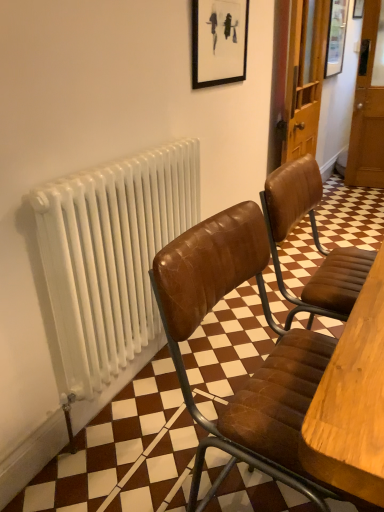
Question: From the image's perspective, is wooden picture frame at upper right located above white metallic radiator at left?

Choices:
 (A) no
 (B) yes

Answer: (B)

Question: From a real-world perspective, is wooden picture frame at upper right located beneath white metallic radiator at left?

Choices:
 (A) yes
 (B) no

Answer: (B)

Question: Considering the relative positions of wooden picture frame at upper right and white metallic radiator at left in the image provided, is wooden picture frame at upper right behind white metallic radiator at left?

Choices:
 (A) yes
 (B) no

Answer: (A)

Question: Considering the relative positions of wooden picture frame at upper right and white metallic radiator at left in the image provided, is wooden picture frame at upper right to the right of white metallic radiator at left from the viewer's perspective?

Choices:
 (A) yes
 (B) no

Answer: (A)

Question: From the image's perspective, is wooden picture frame at upper right located beneath white metallic radiator at left?

Choices:
 (A) no
 (B) yes

Answer: (A)

Question: From a real-world perspective, is wooden picture frame at upper right physically above white metallic radiator at left?

Choices:
 (A) no
 (B) yes

Answer: (B)

Question: Is white metallic radiator at left closer to the viewer compared to wooden picture frame at upper right?

Choices:
 (A) no
 (B) yes

Answer: (B)

Question: From the image's perspective, is white metallic radiator at left located beneath wooden picture frame at upper right?

Choices:
 (A) yes
 (B) no

Answer: (A)

Question: Is white metallic radiator at left smaller than wooden picture frame at upper right?

Choices:
 (A) no
 (B) yes

Answer: (B)

Question: Considering the relative sizes of white metallic radiator at left and wooden picture frame at upper right in the image provided, is white metallic radiator at left bigger than wooden picture frame at upper right?

Choices:
 (A) no
 (B) yes

Answer: (A)

Question: Is white metallic radiator at left with wooden picture frame at upper right?

Choices:
 (A) yes
 (B) no

Answer: (B)

Question: From a real-world perspective, is white metallic radiator at left located higher than wooden picture frame at upper right?

Choices:
 (A) no
 (B) yes

Answer: (A)

Question: In terms of width, does wooden picture frame at upper right look wider or thinner when compared to white metallic radiator at left?

Choices:
 (A) wide
 (B) thin

Answer: (A)